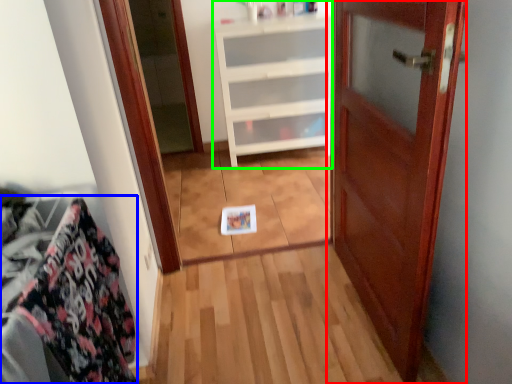
Question: Estimate the real-world distances between objects in this image. Which object is closer to door (highlighted by a red box), material (highlighted by a blue box) or cabinetry (highlighted by a green box)?

Choices:
 (A) material
 (B) cabinetry

Answer: (A)